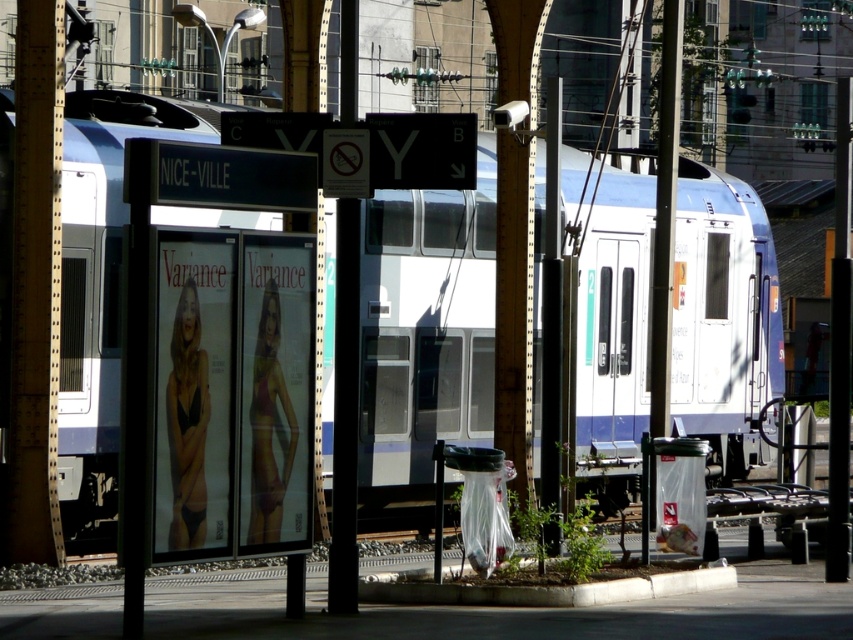
Question: Observing the image, what is the correct spatial positioning of white glossy train at center in reference to clear glass bus stop at center?

Choices:
 (A) above
 (B) below

Answer: (A)

Question: Which of the following is the farthest from the observer?

Choices:
 (A) (154, 385)
 (B) (352, 298)
 (C) (552, 541)
 (D) (408, 477)

Answer: (D)

Question: Based on their relative distances, which object is nearer to the black metal pole at center?

Choices:
 (A) white glossy train at center
 (B) clear glass bus stop at center
 (C) metallic pole at center

Answer: (C)

Question: Does white glossy train at center appear over metallic pole at center?

Choices:
 (A) yes
 (B) no

Answer: (B)

Question: Where is metallic pole at center located in relation to black metal pole at center in the image?

Choices:
 (A) above
 (B) below

Answer: (A)

Question: Which object is closer to the camera taking this photo?

Choices:
 (A) black metal pole at center
 (B) clear glass bus stop at center
 (C) metallic pole at center

Answer: (B)